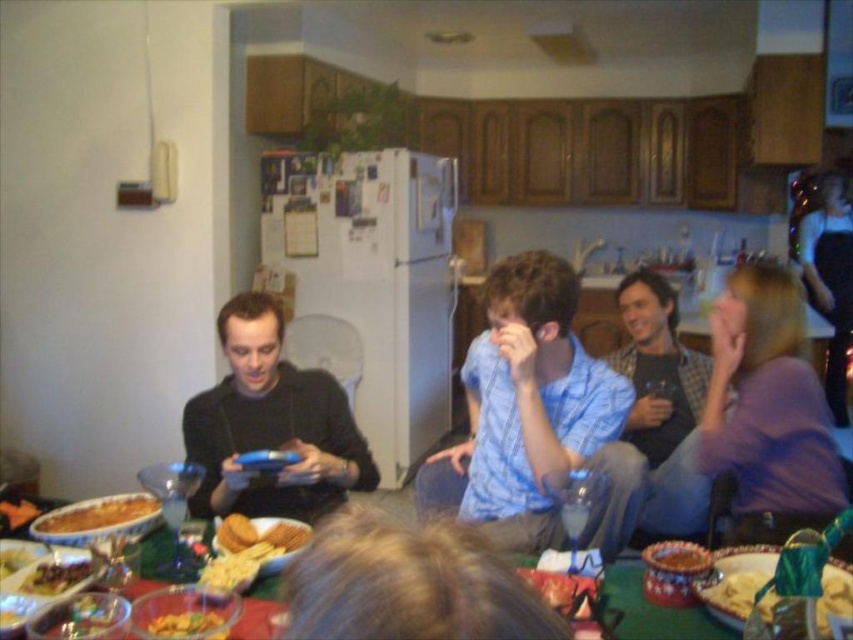
Does black matte shirt at center appear over green felt table at lower center?

Yes.

Is black matte shirt at center smaller than green felt table at lower center?

No, black matte shirt at center is not smaller than green felt table at lower center.

Which is in front, point (242, 308) or point (627, 618)?

Point (627, 618) is more forward.

Where is `black matte shirt at center`? The height and width of the screenshot is (640, 853). black matte shirt at center is located at coordinates (271, 426).

Describe the element at coordinates (259, 532) in the screenshot. I see `golden crispy chips at center` at that location.

What do you see at coordinates (259, 532) in the screenshot? I see `golden crispy chips at center` at bounding box center [259, 532].

Image resolution: width=853 pixels, height=640 pixels. In order to click on golden crispy chips at center in this screenshot , I will do `click(259, 532)`.

Is green felt table at lower center shorter than yellow crumbly snack at center?

Incorrect, green felt table at lower center's height does not fall short of yellow crumbly snack at center's.

Who is higher up, green felt table at lower center or yellow crumbly snack at center?

yellow crumbly snack at center

Between point (169, 554) and point (173, 621), which one is positioned behind?

The point (169, 554) is more distant.

You are a GUI agent. You are given a task and a screenshot of the screen. Output one action in this format:
    pyautogui.click(x=<x>, y=<y>)
    Task: Click on the green felt table at lower center
    
    Given the screenshot: What is the action you would take?
    pyautogui.click(x=654, y=611)